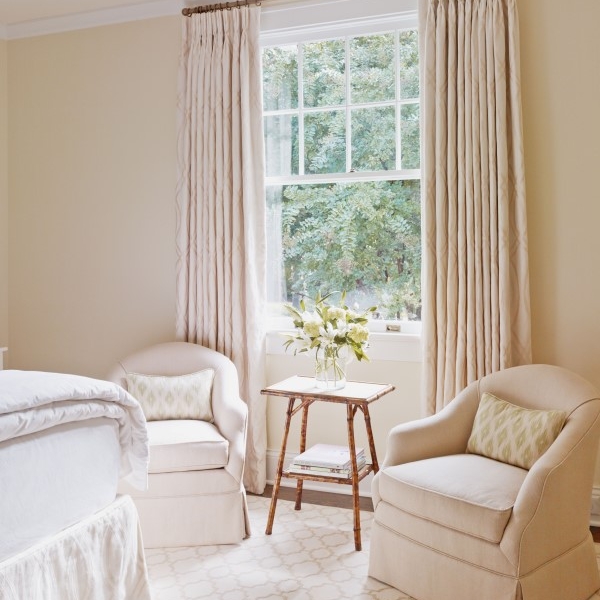
Identify the location of window curtains. Image resolution: width=600 pixels, height=600 pixels. [223, 19], [471, 5].